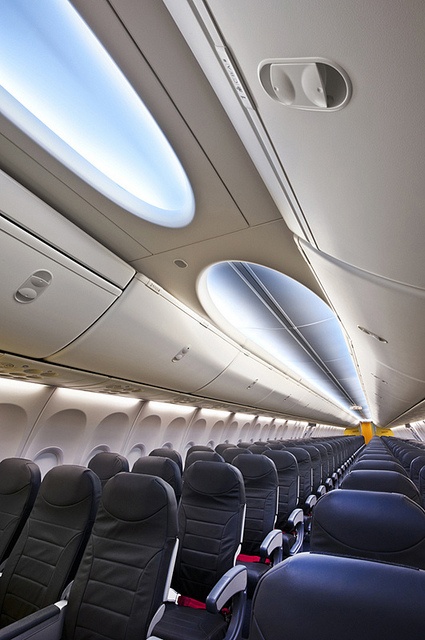
This screenshot has width=425, height=640. What are the coordinates of `seats` in the screenshot? It's located at (175, 619), (260, 564), (289, 534), (307, 518).